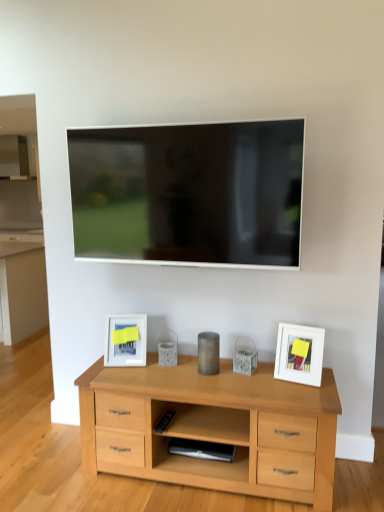
Question: Does point (110, 315) appear closer or farther from the camera than point (107, 161)?

Choices:
 (A) closer
 (B) farther

Answer: (B)

Question: From a real-world perspective, is white matte picture frame at lower left, which appears as the first picture frame when viewed from the back, above or below matte black tv at upper center?

Choices:
 (A) above
 (B) below

Answer: (B)

Question: Considering the real-world distances, which object is farthest from the white matte picture frame at lower left, which appears as the first picture frame when viewed from the back?

Choices:
 (A) metallic cylinder at center, the first appliance from the top
 (B) matte black tv at upper center
 (C) white matte picture frame at right, the first picture frame when ordered from right to left
 (D) satin black speaker at lower center, the 1th appliance when ordered from bottom to top

Answer: (C)

Question: Estimate the real-world distances between objects in this image. Which object is closer to the matte black tv at upper center?

Choices:
 (A) metallic cylinder at center, marked as the second appliance in a bottom-to-top arrangement
 (B) white matte picture frame at lower left, which appears as the first picture frame when viewed from the back
 (C) white matte picture frame at right, marked as the first picture frame in a front-to-back arrangement
 (D) satin black speaker at lower center, the 1th appliance when ordered from bottom to top

Answer: (B)